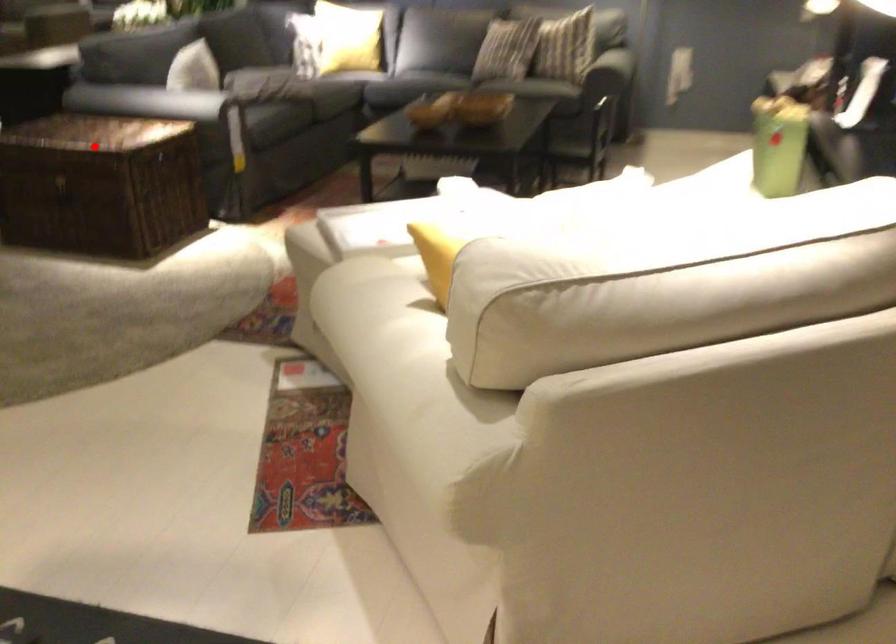
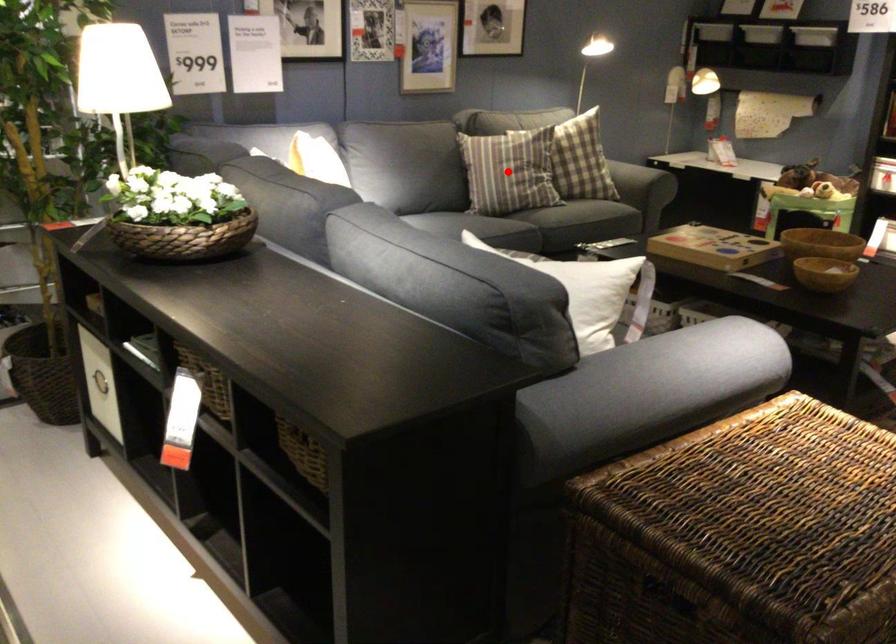
I am providing you with two images of the same scene from different viewpoints. A red point is marked on the first image and another point is marked on the second image. Is the marked point in image1 the same physical position as the marked point in image2?

No